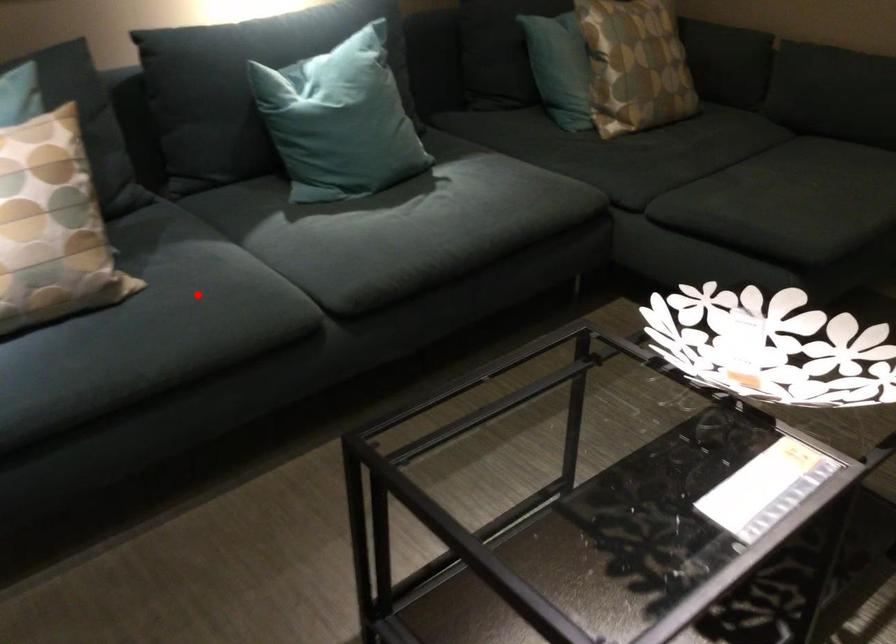
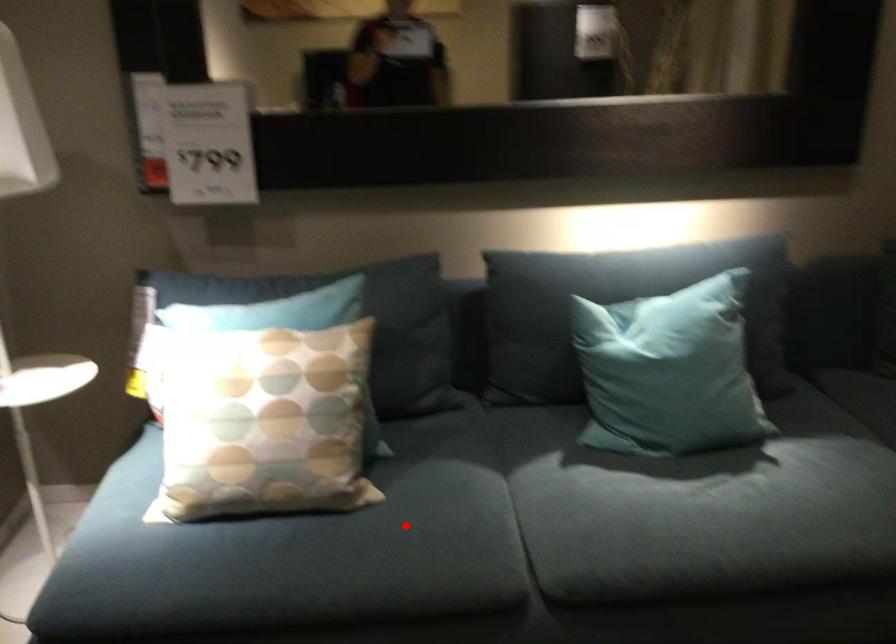
I am providing you with two images of the same scene from different viewpoints. A red point is marked on the first image and another point is marked on the second image. Is the marked point in image1 the same physical position as the marked point in image2?

Yes